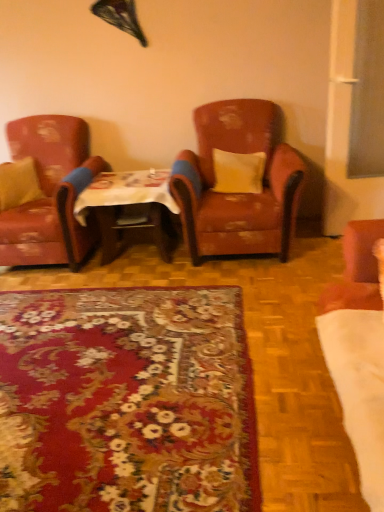
Question: Is wooden table at center to the left or to the right of yellow fabric pillow at center, which is the first pillow in right-to-left order, in the image?

Choices:
 (A) left
 (B) right

Answer: (A)

Question: Relative to yellow fabric pillow at center, which is the first pillow in right-to-left order, is wooden table at center in front or behind?

Choices:
 (A) front
 (B) behind

Answer: (A)

Question: Estimate the real-world distances between objects in this image. Which object is closer to the matte yellow pillow at left, the 2th pillow in the right-to-left sequence?

Choices:
 (A) yellow fabric pillow at center, which is the first pillow in right-to-left order
 (B) floral carpet at center
 (C) leather-like brown armchair at center, which appears as the 1th chair when viewed from the right
 (D) leather armchair at left, marked as the first chair in a left-to-right arrangement
 (E) wooden table at center

Answer: (D)

Question: Which object is positioned farthest from the yellow fabric pillow at center, which is counted as the 2th pillow, starting from the left?

Choices:
 (A) matte yellow pillow at left, positioned as the first pillow in left-to-right order
 (B) leather-like brown armchair at center, the second chair positioned from the left
 (C) leather armchair at left, the second chair when ordered from right to left
 (D) floral carpet at center
 (E) wooden table at center

Answer: (D)